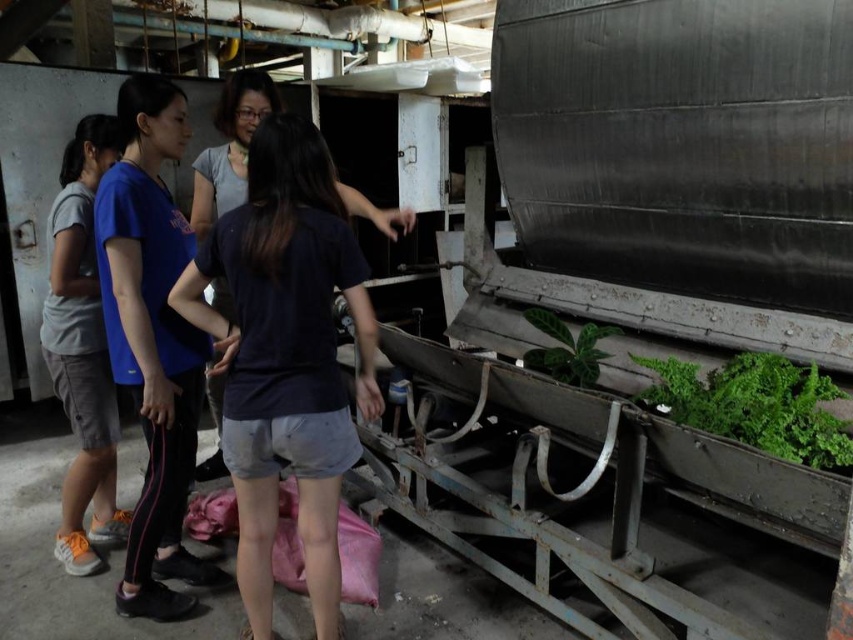
Question: Does matte gray shorts at left appear on the left side of green glossy leaf at center?

Choices:
 (A) yes
 (B) no

Answer: (A)

Question: Which point is farther to the camera?

Choices:
 (A) (114, 353)
 (B) (579, 362)

Answer: (B)

Question: Among these objects, which one is farthest from the camera?

Choices:
 (A) blue fabric pants at left
 (B) green glossy leaf at center
 (C) matte gray shorts at left
 (D) green leafy plant at right

Answer: (C)

Question: Which point appears farthest from the camera in this image?

Choices:
 (A) (695, 394)
 (B) (558, 376)
 (C) (103, 532)

Answer: (C)

Question: Considering the relative positions of green leafy plant at right and green glossy leaf at center in the image provided, where is green leafy plant at right located with respect to green glossy leaf at center?

Choices:
 (A) above
 (B) below

Answer: (B)

Question: Is blue fabric pants at left positioned before matte gray shorts at left?

Choices:
 (A) no
 (B) yes

Answer: (B)